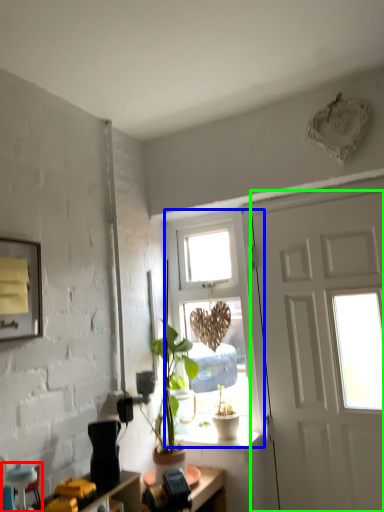
Question: Estimate the real-world distances between objects in this image. Which object is farther from armchair (highlighted by a red box), window (highlighted by a blue box) or door (highlighted by a green box)?

Choices:
 (A) window
 (B) door

Answer: (B)